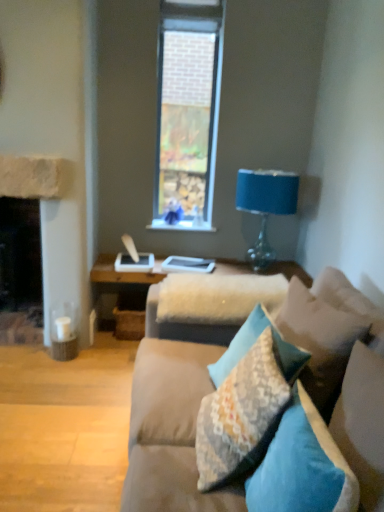
Question: Can you confirm if blue fabric-covered lamp at upper right is positioned to the right of textured floral pillow at center, the fifth pillow positioned from the front?

Choices:
 (A) yes
 (B) no

Answer: (A)

Question: Does blue fabric-covered lamp at upper right have a greater width compared to textured floral pillow at center, the fifth pillow positioned from the front?

Choices:
 (A) no
 (B) yes

Answer: (B)

Question: Does blue fabric-covered lamp at upper right contain textured floral pillow at center, placed as the 1th pillow when sorted from back to front?

Choices:
 (A) no
 (B) yes

Answer: (A)

Question: Is blue fabric-covered lamp at upper right oriented away from textured floral pillow at center, placed as the 1th pillow when sorted from back to front?

Choices:
 (A) yes
 (B) no

Answer: (B)

Question: Is blue fabric-covered lamp at upper right far from textured floral pillow at center, placed as the 1th pillow when sorted from back to front?

Choices:
 (A) no
 (B) yes

Answer: (B)

Question: Is blue fabric-covered lamp at upper right further to camera compared to textured floral pillow at center, the fifth pillow positioned from the front?

Choices:
 (A) no
 (B) yes

Answer: (B)

Question: From a real-world perspective, is textured floral pillow at center, the fifth pillow positioned from the front, physically below teal fabric pillow at center, acting as the first pillow starting from the front?

Choices:
 (A) yes
 (B) no

Answer: (A)

Question: Is textured floral pillow at center, placed as the 1th pillow when sorted from back to front, not close to teal fabric pillow at center, placed as the fifth pillow when sorted from back to front?

Choices:
 (A) no
 (B) yes

Answer: (A)

Question: Is textured floral pillow at center, the fifth pillow positioned from the front, next to teal fabric pillow at center, placed as the fifth pillow when sorted from back to front?

Choices:
 (A) yes
 (B) no

Answer: (B)

Question: Can you confirm if textured floral pillow at center, the fifth pillow positioned from the front, is taller than teal fabric pillow at center, placed as the fifth pillow when sorted from back to front?

Choices:
 (A) yes
 (B) no

Answer: (B)

Question: Can teal fabric pillow at center, acting as the first pillow starting from the front, be found inside textured floral pillow at center, the fifth pillow positioned from the front?

Choices:
 (A) yes
 (B) no

Answer: (B)

Question: Can you confirm if textured floral pillow at center, the fifth pillow positioned from the front, is shorter than teal fabric pillow at center, placed as the fifth pillow when sorted from back to front?

Choices:
 (A) no
 (B) yes

Answer: (B)

Question: From the image's perspective, is teal fabric pillow at center, placed as the fourth pillow when sorted from back to front, below textured beige pillow at lower right, which is the second pillow from back to front?

Choices:
 (A) yes
 (B) no

Answer: (A)